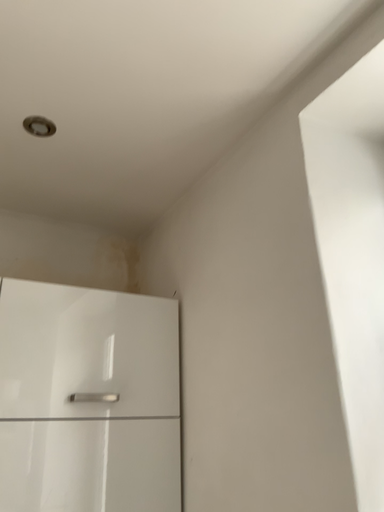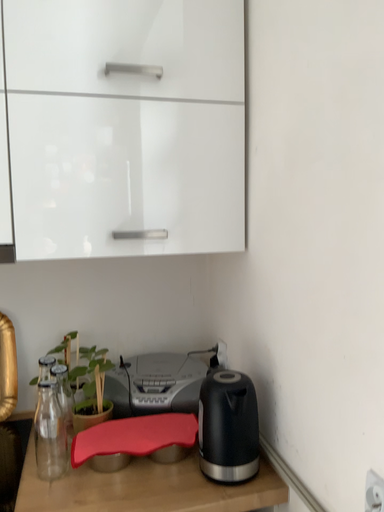
Question: Which way did the camera rotate in the video?

Choices:
 (A) rotated upward
 (B) rotated downward

Answer: (B)